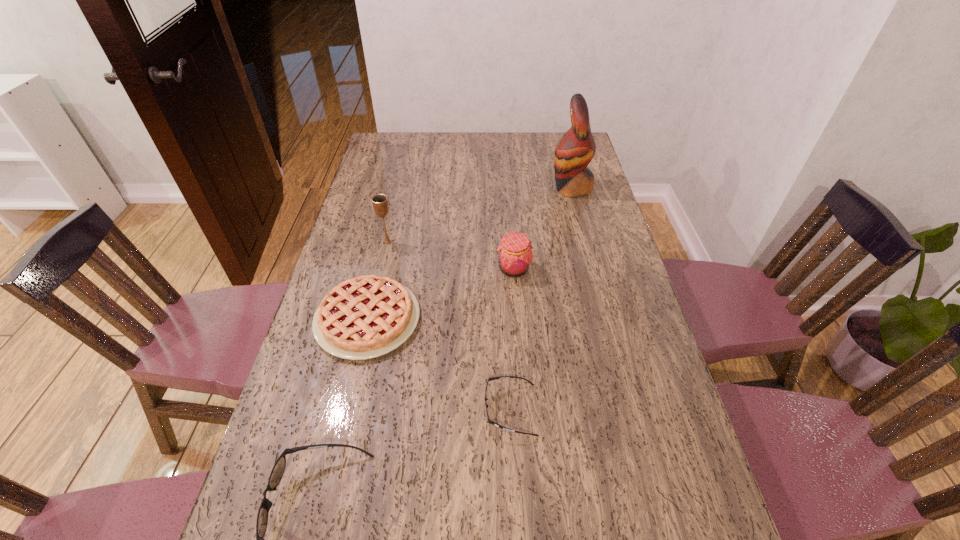
Image resolution: width=960 pixels, height=540 pixels. In order to click on object positioned at the right edge in this screenshot , I will do click(574, 151).

In the image, there is a desktop. At what (x,y) coordinates should I click in order to perform the action: click on vacant space at the far edge. Please return your answer as a coordinate pair (x, y). The width and height of the screenshot is (960, 540). Looking at the image, I should click on (442, 133).

In the image, there is a desktop. Where is `vacant region at the near edge`? Image resolution: width=960 pixels, height=540 pixels. vacant region at the near edge is located at coordinates (488, 496).

The width and height of the screenshot is (960, 540). What are the coordinates of `blank space at the left edge` in the screenshot? It's located at (347, 271).

In the image, there is a desktop. Identify the location of vacant region at the right edge. (602, 193).

Locate an element on the screen. The height and width of the screenshot is (540, 960). free region at the far left corner of the desktop is located at coordinates (401, 134).

You are a GUI agent. You are given a task and a screenshot of the screen. Output one action in this format:
    pyautogui.click(x=<x>, y=<y>)
    Task: Click on the free space between the shorter sunglasses and the chalice
    The width and height of the screenshot is (960, 540).
    Given the screenshot: What is the action you would take?
    pyautogui.click(x=449, y=326)

The width and height of the screenshot is (960, 540). Find the location of `unoccupied area between the right sunglasses and the third farthest object`. unoccupied area between the right sunglasses and the third farthest object is located at coordinates (512, 339).

Locate an element on the screen. The width and height of the screenshot is (960, 540). empty space between the second nearest object and the third nearest object is located at coordinates (439, 364).

Find the location of `free space between the fifth farthest object and the third tallest object`. free space between the fifth farthest object and the third tallest object is located at coordinates (512, 339).